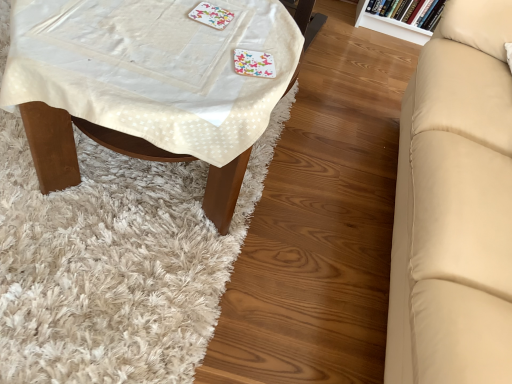
Identify the location of free space between white textured mat at lower left and beige leather couch at right. This screenshot has height=384, width=512. (317, 190).